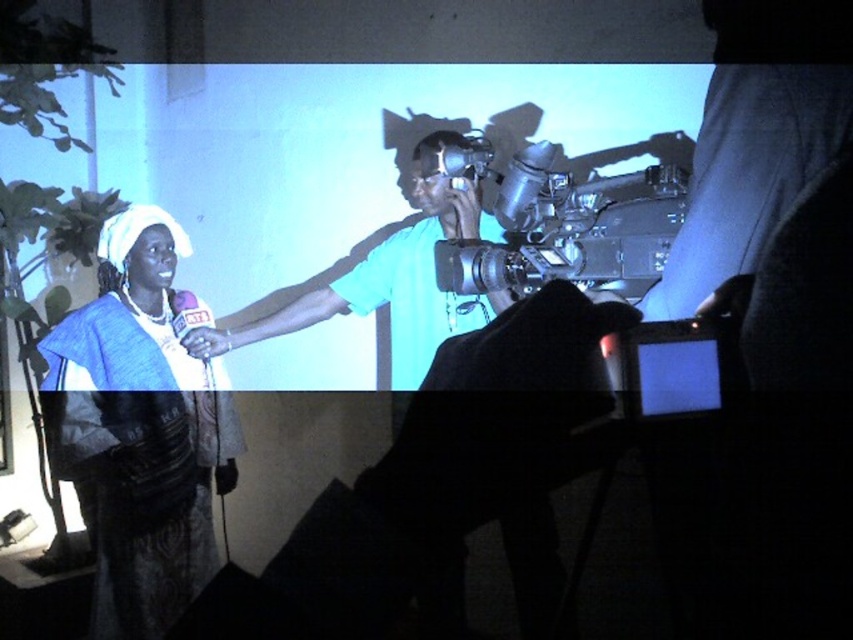
Question: Can you confirm if matte blue dress at left is thinner than teal matte camera at center?

Choices:
 (A) yes
 (B) no

Answer: (A)

Question: Is matte blue dress at left positioned in front of metallic silver video camera at center?

Choices:
 (A) yes
 (B) no

Answer: (B)

Question: Is matte blue dress at left to the left of metallic silver video camera at center from the viewer's perspective?

Choices:
 (A) yes
 (B) no

Answer: (A)

Question: Which point is farther from the camera taking this photo?

Choices:
 (A) (80, 422)
 (B) (357, 269)

Answer: (B)

Question: Which point is farther from the camera taking this photo?

Choices:
 (A) (450, 243)
 (B) (142, 244)

Answer: (B)

Question: Among these points, which one is farthest from the camera?

Choices:
 (A) (119, 552)
 (B) (630, 273)
 (C) (403, 365)

Answer: (C)